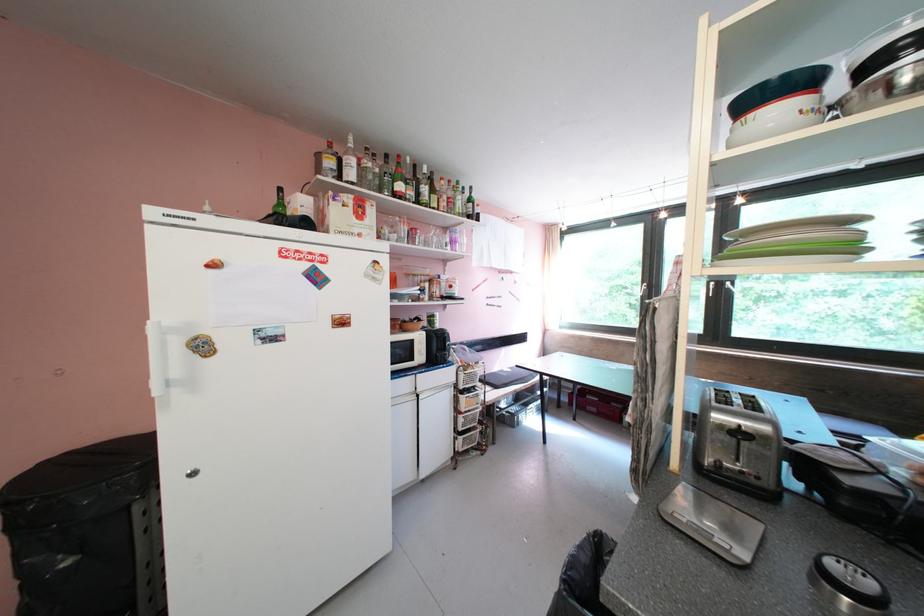
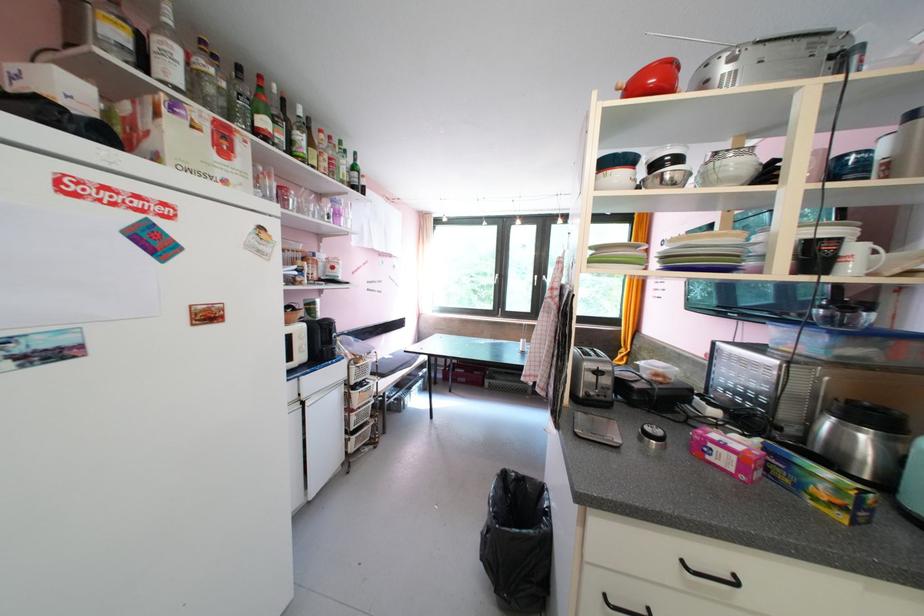
Locate, in the second image, the point that corresponds to [368,167] in the first image.

(196, 65)